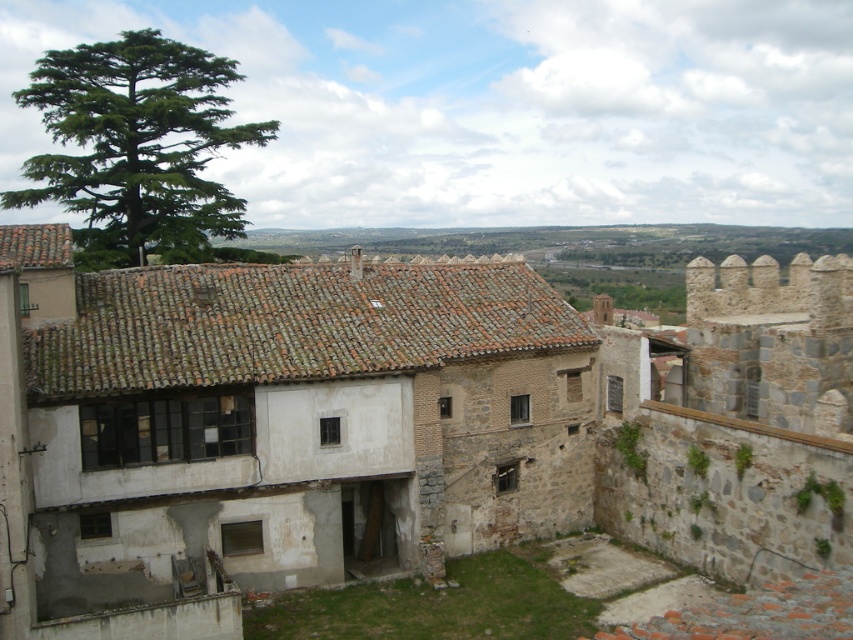
Is rustic stone castle at center above green needle-like tree at upper left?

Incorrect, rustic stone castle at center is not positioned above green needle-like tree at upper left.

How distant is rustic stone castle at center from green needle-like tree at upper left?

They are 23.24 meters apart.

Who is more distant from viewer, (267, 508) or (96, 108)?

Point (96, 108)

What are the coordinates of `rustic stone castle at center` in the screenshot? It's located at (392, 426).